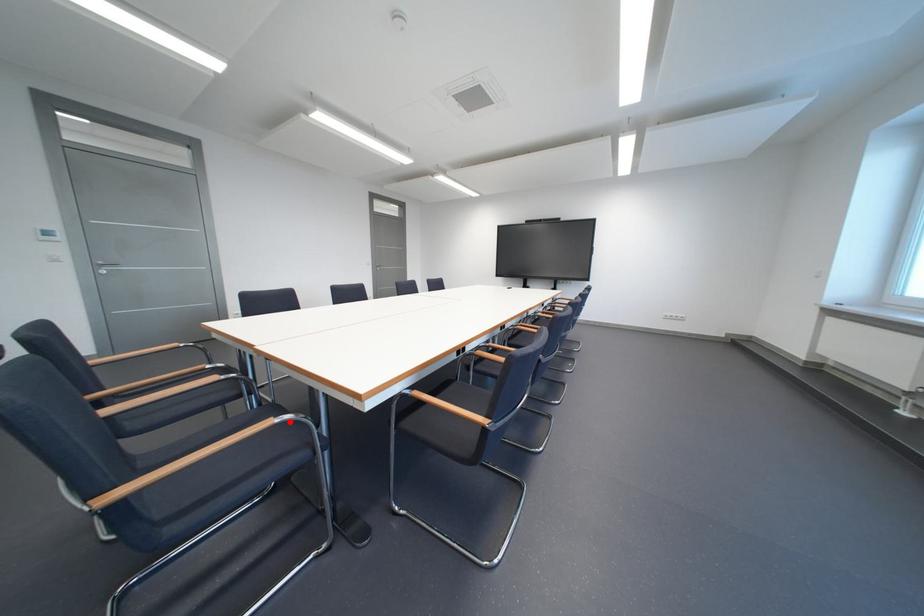
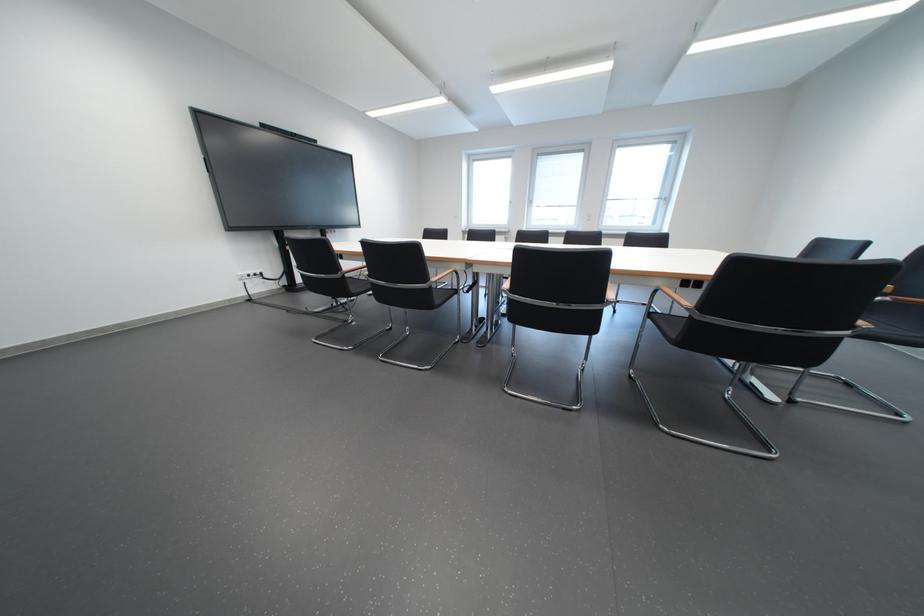
Question: I am providing you with two images of the same scene from different viewpoints. A red point is marked on the first image. At the location where the point appears in image 1, is it still visible in image 2?

Choices:
 (A) Yes
 (B) No

Answer: (B)